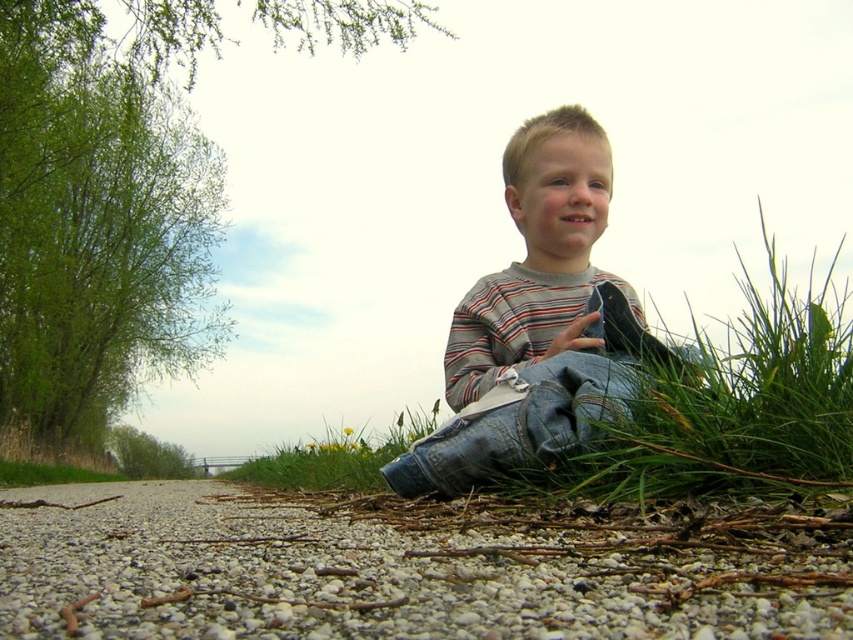
Measure the distance from striped cotton shirt at center to green grass at lower center.

striped cotton shirt at center and green grass at lower center are 1.50 meters apart.

Does striped cotton shirt at center have a lesser width compared to green grass at lower center?

Yes.

Find the location of `striped cotton shirt at center`. striped cotton shirt at center is located at coordinates (527, 317).

Find the location of a particular element. The width and height of the screenshot is (853, 640). striped cotton shirt at center is located at coordinates (527, 317).

Is point (357, 637) closer to camera compared to point (532, 186)?

Yes, point (357, 637) is closer to viewer.

Does gray gravel at lower center come in front of striped cotton shirt at center?

Yes, it is in front of striped cotton shirt at center.

This screenshot has height=640, width=853. I want to click on gray gravel at lower center, so click(x=410, y=566).

Who is positioned more to the left, gray gravel at lower center or green grass at lower center?

green grass at lower center is more to the left.

Is the position of gray gravel at lower center more distant than that of green grass at lower center?

No, it is not.

Which is behind, point (143, 609) or point (361, 435)?

Positioned behind is point (361, 435).

Locate an element on the screen. The image size is (853, 640). gray gravel at lower center is located at coordinates (410, 566).